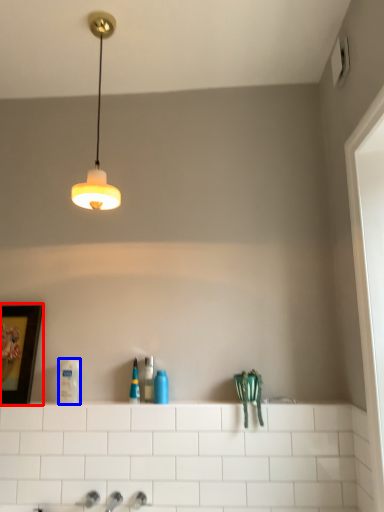
Question: Which object is closer to the camera taking this photo, picture frame (highlighted by a red box) or toiletry (highlighted by a blue box)?

Choices:
 (A) picture frame
 (B) toiletry

Answer: (B)